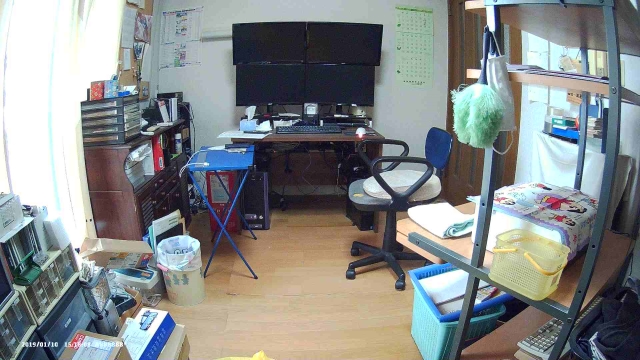
Image resolution: width=640 pixels, height=360 pixels. Identify the location of computer chair. (436, 153).